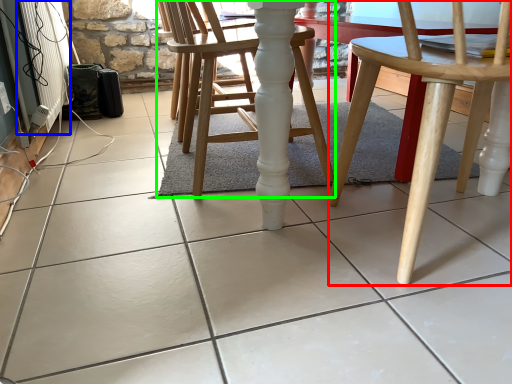
Question: Based on their relative distances, which object is farther from chair (highlighted by a red box)? Choose from radiator (highlighted by a blue box) and chair (highlighted by a green box).

Choices:
 (A) radiator
 (B) chair

Answer: (A)